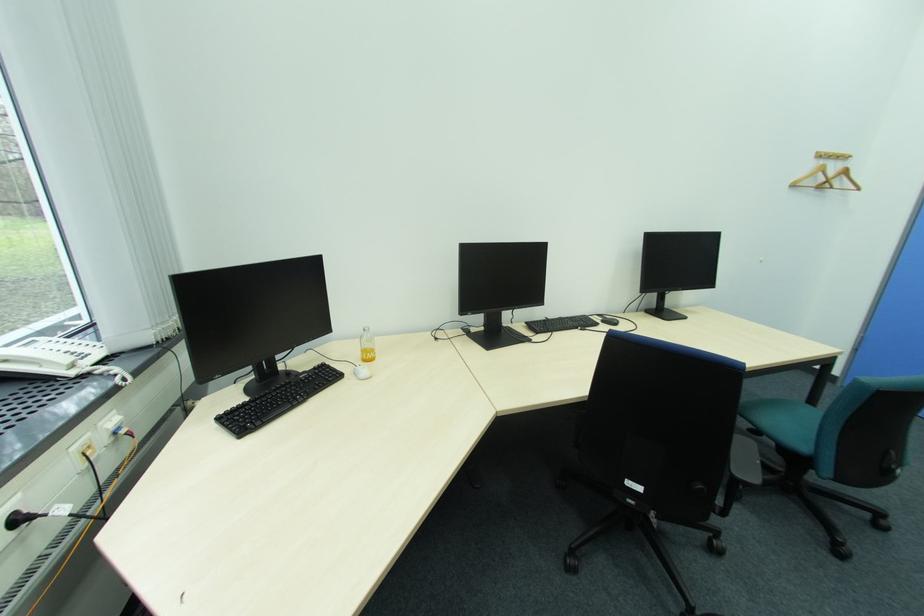
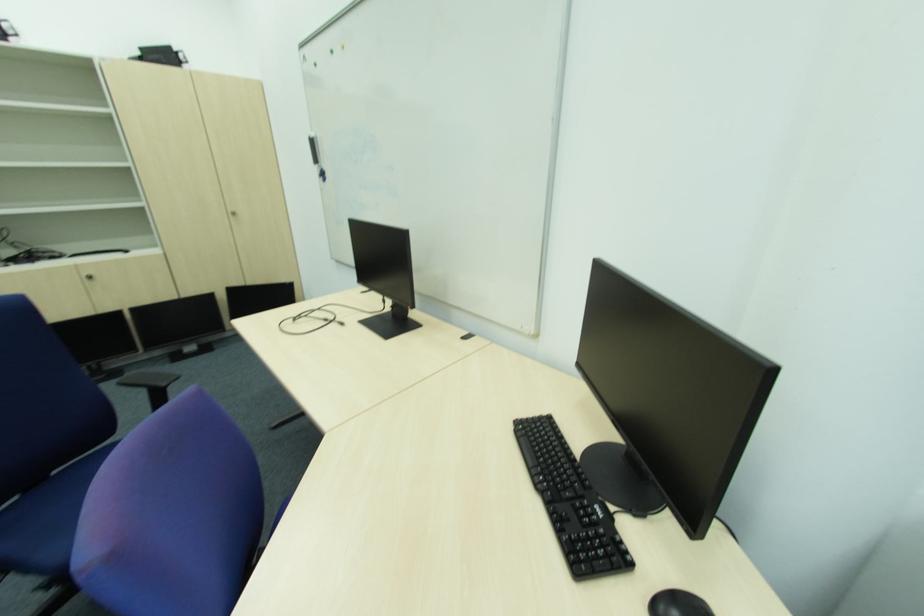
First-person continuous shooting, in which direction is the camera rotating?

The camera rotated toward right-down.